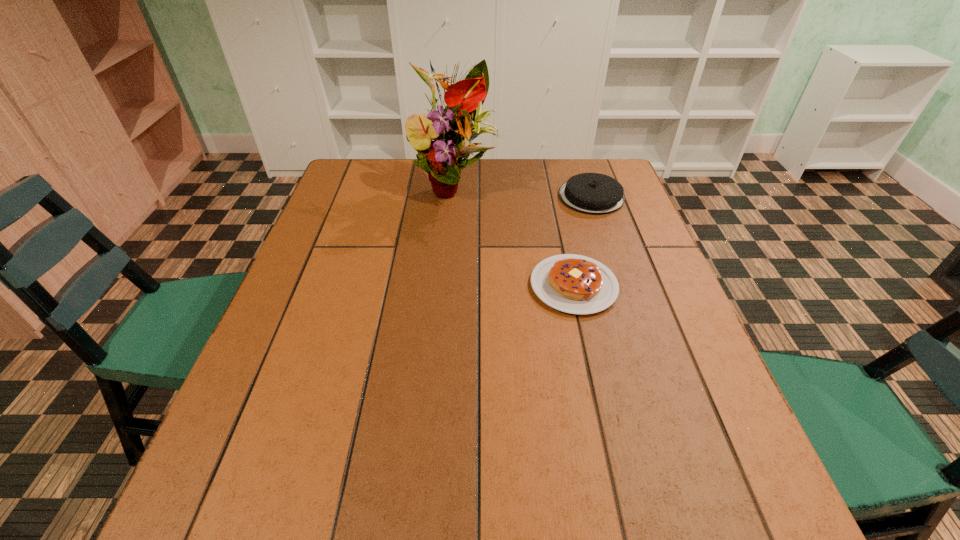
Image resolution: width=960 pixels, height=540 pixels. I want to click on pancake situated at the far edge, so pos(591,193).

At what (x,y) coordinates should I click in order to perform the action: click on object at the far right corner. Please return your answer as a coordinate pair (x, y). This screenshot has width=960, height=540. Looking at the image, I should click on (591, 193).

In the image, there is a desktop. Where is `vacant space at the far edge`? The image size is (960, 540). vacant space at the far edge is located at coordinates (477, 184).

Locate an element on the screen. The width and height of the screenshot is (960, 540). vacant space at the near edge of the desktop is located at coordinates (584, 485).

In the image, there is a desktop. Where is `vacant space at the left edge`? vacant space at the left edge is located at coordinates (321, 220).

What are the coordinates of `free spot at the far left corner of the desktop` in the screenshot? It's located at [357, 163].

You are a GUI agent. You are given a task and a screenshot of the screen. Output one action in this format:
    pyautogui.click(x=<x>, y=<y>)
    Task: Click on the unoccupied area between the shortest object and the tallest object
    
    Given the screenshot: What is the action you would take?
    pyautogui.click(x=515, y=235)

What are the coordinates of `vacant region between the nearest object and the taller pancake` in the screenshot? It's located at (583, 241).

The width and height of the screenshot is (960, 540). What are the coordinates of `vacant space that is in between the farther pancake and the shorter pancake` in the screenshot? It's located at (583, 241).

This screenshot has width=960, height=540. What are the coordinates of `vacant space in between the tallest object and the farther pancake` in the screenshot? It's located at point(523,191).